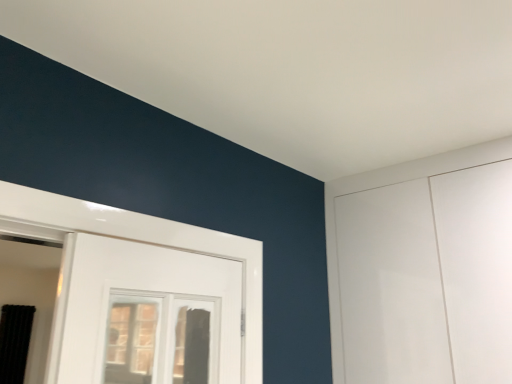
Question: In the image, is black fabric curtain at left positioned in front of or behind clear glass window at center?

Choices:
 (A) front
 (B) behind

Answer: (B)

Question: Do you think black fabric curtain at left is within clear glass window at center, or outside of it?

Choices:
 (A) outside
 (B) inside

Answer: (A)

Question: Is point (17, 319) closer or farther from the camera than point (153, 291)?

Choices:
 (A) closer
 (B) farther

Answer: (B)

Question: Do you think clear glass window at center is within black fabric curtain at left, or outside of it?

Choices:
 (A) outside
 (B) inside

Answer: (A)

Question: Is clear glass window at center bigger or smaller than black fabric curtain at left?

Choices:
 (A) small
 (B) big

Answer: (B)

Question: From the image's perspective, is clear glass window at center above or below black fabric curtain at left?

Choices:
 (A) above
 (B) below

Answer: (A)

Question: Considering the positions of clear glass window at center and black fabric curtain at left in the image, is clear glass window at center wider or thinner than black fabric curtain at left?

Choices:
 (A) wide
 (B) thin

Answer: (B)